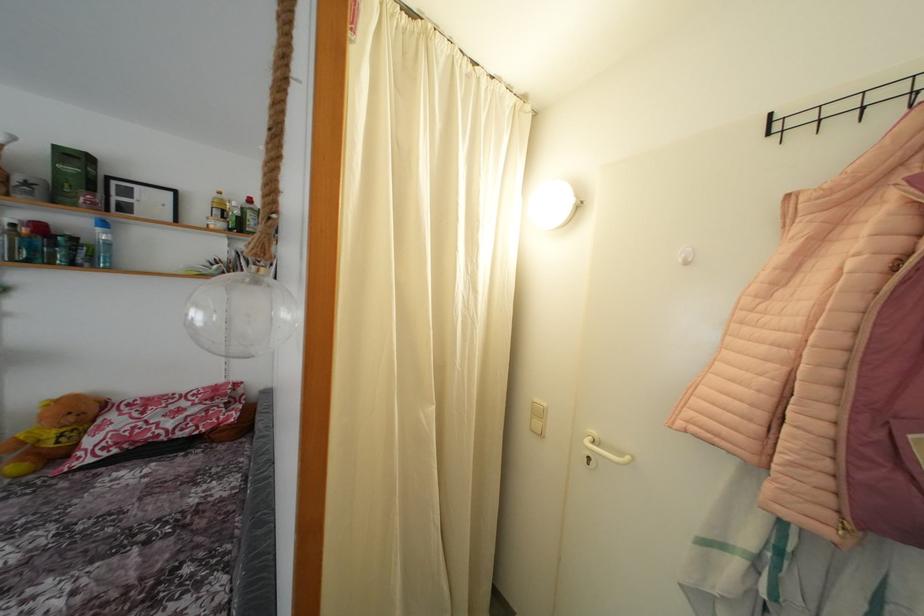
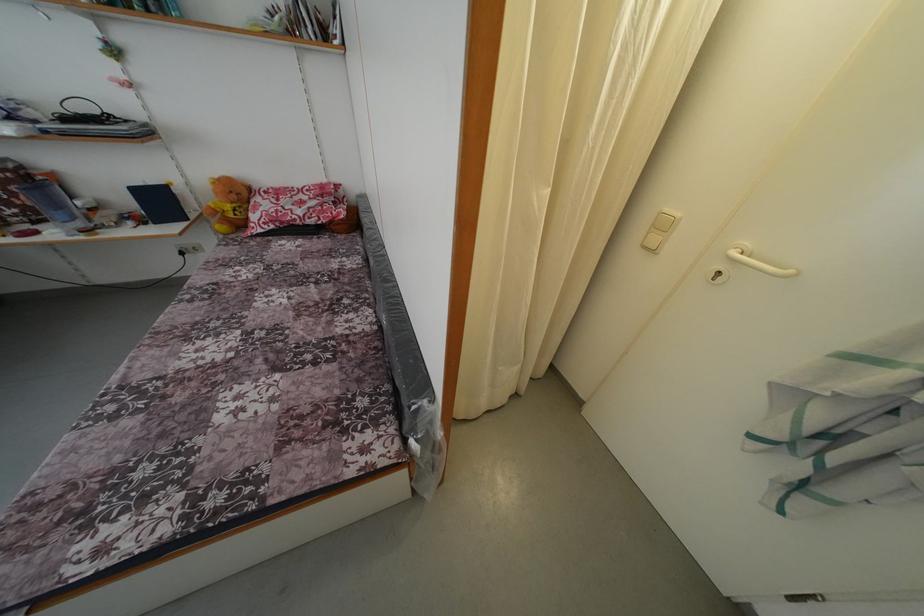
Question: How did the camera likely rotate?

Choices:
 (A) Left
 (B) Right
 (C) Up
 (D) Down

Answer: (D)